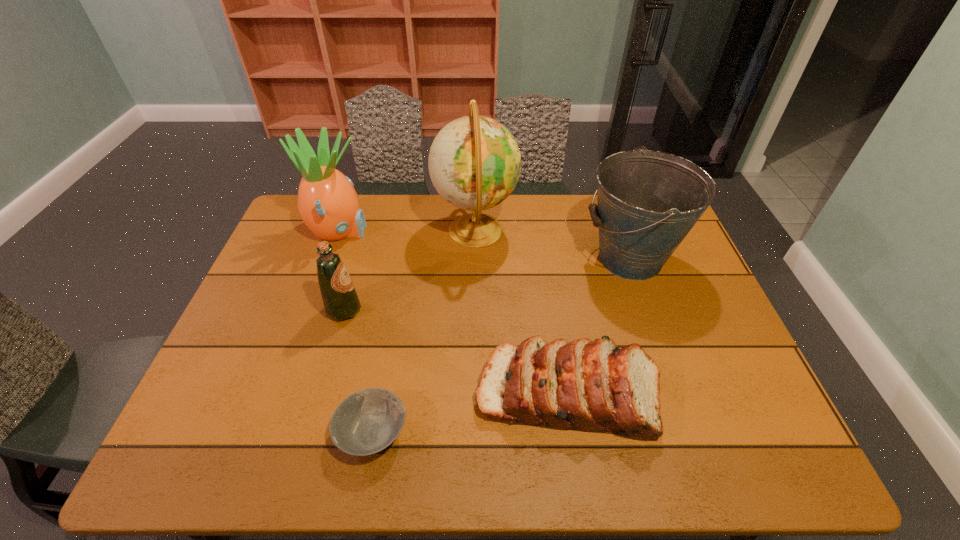
I want to click on free point that satisfies the following two spatial constraints: 1. with the handle on opposite sides of the bucket; 2. on the front side of the shortest object, so click(691, 432).

I want to click on vacant area that satisfies the following two spatial constraints: 1. on the front-facing side of the bowl; 2. on the right side of the third nearest object, so click(x=309, y=432).

Identify the location of vacant space that satisfies the following two spatial constraints: 1. at the entrance of the pineapple; 2. on the left side of the fifth tallest object. (281, 393).